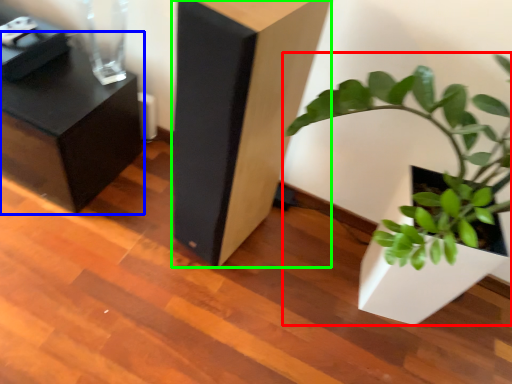
Question: Which is nearer to the houseplant (highlighted by a red box)? furniture (highlighted by a blue box) or furniture (highlighted by a green box).

Choices:
 (A) furniture
 (B) furniture

Answer: (B)